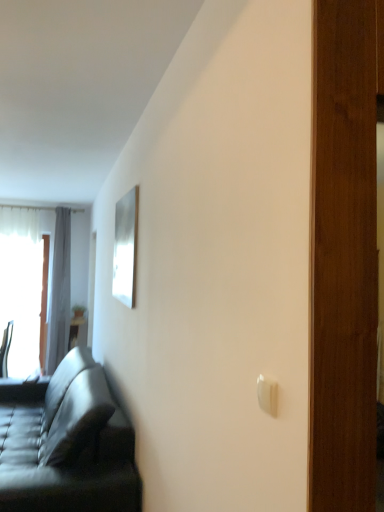
Question: From a real-world perspective, is white plastic light switch at lower right positioned under leather couch at left based on gravity?

Choices:
 (A) yes
 (B) no

Answer: (B)

Question: Can you confirm if white plastic light switch at lower right is wider than leather couch at left?

Choices:
 (A) yes
 (B) no

Answer: (B)

Question: Considering the relative positions of white plastic light switch at lower right and leather couch at left in the image provided, is white plastic light switch at lower right in front of leather couch at left?

Choices:
 (A) no
 (B) yes

Answer: (B)

Question: From a real-world perspective, is white plastic light switch at lower right located higher than leather couch at left?

Choices:
 (A) no
 (B) yes

Answer: (B)

Question: Is white plastic light switch at lower right positioned with its back to leather couch at left?

Choices:
 (A) no
 (B) yes

Answer: (A)

Question: Would you say leather couch at left is part of white plastic light switch at lower right's contents?

Choices:
 (A) no
 (B) yes

Answer: (A)

Question: From a real-world perspective, does wooden table at left sit lower than gray fabric curtain at left?

Choices:
 (A) yes
 (B) no

Answer: (A)

Question: Is wooden table at left bigger than gray fabric curtain at left?

Choices:
 (A) no
 (B) yes

Answer: (A)

Question: Does wooden table at left appear on the right side of gray fabric curtain at left?

Choices:
 (A) no
 (B) yes

Answer: (B)

Question: Does wooden table at left come in front of gray fabric curtain at left?

Choices:
 (A) yes
 (B) no

Answer: (B)

Question: Does wooden table at left have a smaller size compared to gray fabric curtain at left?

Choices:
 (A) yes
 (B) no

Answer: (A)

Question: Is wooden table at left not near gray fabric curtain at left?

Choices:
 (A) yes
 (B) no

Answer: (B)

Question: Does metallic silver chair at left have a greater height compared to leather couch at left?

Choices:
 (A) yes
 (B) no

Answer: (B)